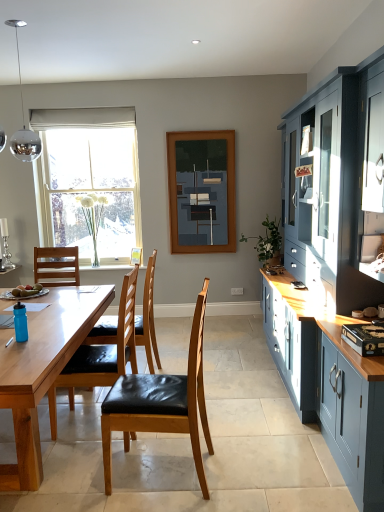
At what (x,y) coordinates should I click in order to perform the action: click on vacant space that is to the left of brown leather chair at center, which is the third chair from back to front. Please return your answer as a coordinate pair (x, y). Looking at the image, I should click on (78, 476).